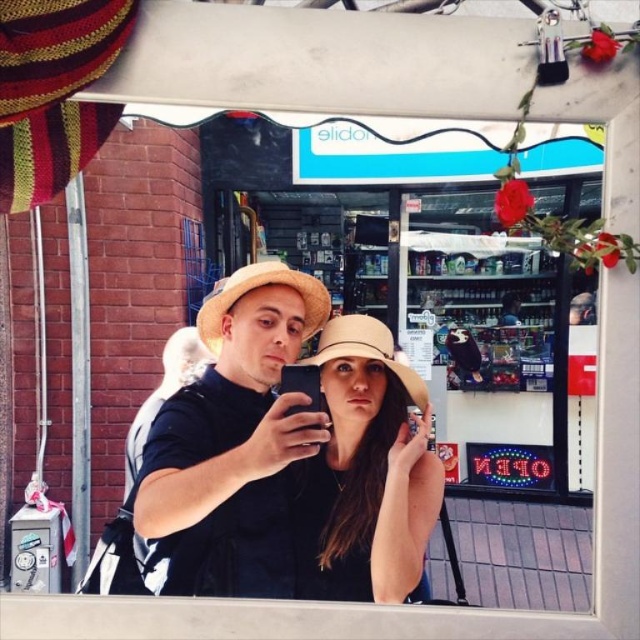
You are taking a photo of two people wearing hats. The matte straw hats at center and the beige woven hat at center are both visible. Which hat is positioned to the left?

The matte straw hats at center is to the left of beige woven hat at center.

You are trying to determine which hat is closer to the camera in the image. Both the matte straw hats at center and the beige woven hat at center are visible. Which one is closer?

The matte straw hats at center is in front of the beige woven hat at center, so the matte straw hats at center is closer to the camera.

You are trying to decide which hat to buy as a souvenir from the convenience store. The matte straw hats at center and the beige woven hat at center are both displayed on a shelf. Which one is bigger?

The matte straw hats at center is larger than the beige woven hat at center.